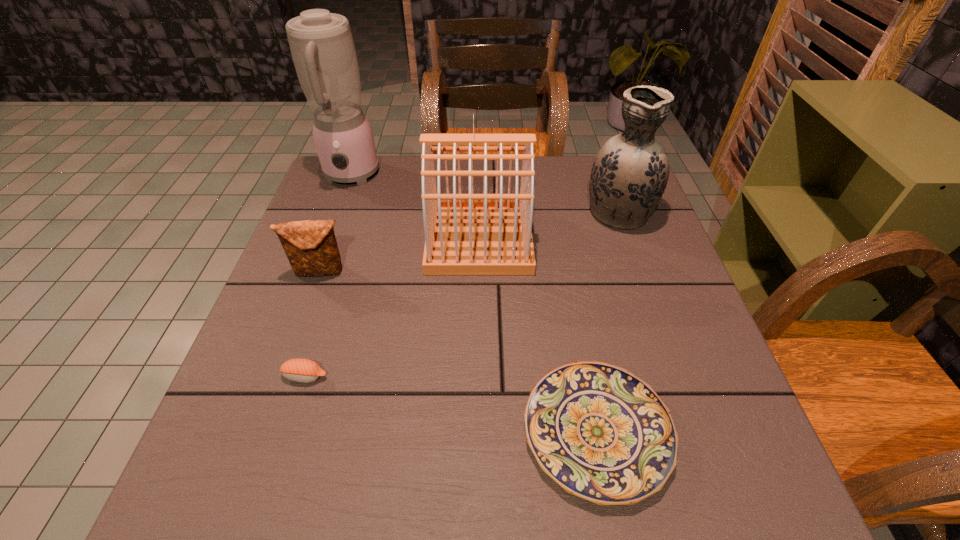
Find the location of a particular element. object present at the far left corner is located at coordinates (322, 48).

This screenshot has width=960, height=540. Find the location of `object present at the far right corner`. object present at the far right corner is located at coordinates (629, 175).

What are the coordinates of `object positioned at the near right corner` in the screenshot? It's located at (601, 433).

The width and height of the screenshot is (960, 540). I want to click on free location at the far edge of the desktop, so click(x=548, y=174).

You are a GUI agent. You are given a task and a screenshot of the screen. Output one action in this format:
    pyautogui.click(x=<x>, y=<y>)
    Task: Click on the vacant space at the near edge
    Image resolution: width=960 pixels, height=540 pixels.
    Given the screenshot: What is the action you would take?
    pyautogui.click(x=374, y=474)

What are the coordinates of `free location at the left edge` in the screenshot? It's located at (324, 361).

In the image, there is a desktop. Identify the location of vacant space at the right edge. (650, 295).

The width and height of the screenshot is (960, 540). Identify the location of free point at the near left corner. (219, 488).

Find the location of `vacant space at the near right corner of the desktop`. vacant space at the near right corner of the desktop is located at coordinates (765, 492).

You are a GUI agent. You are given a task and a screenshot of the screen. Output one action in this format:
    pyautogui.click(x=<x>, y=<y>)
    Task: Click on the unoccupied area between the plate and the second shortest object
    
    Given the screenshot: What is the action you would take?
    pyautogui.click(x=451, y=404)